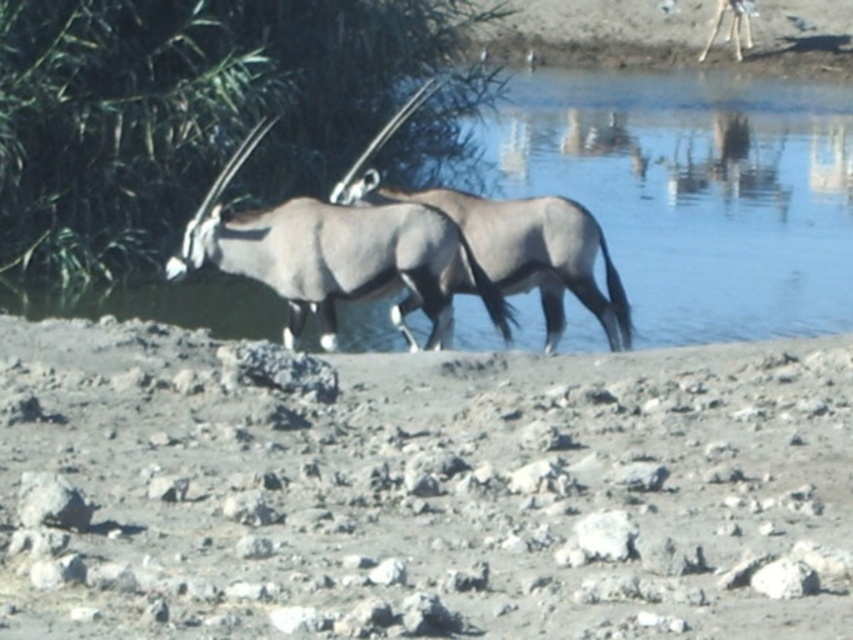
How far apart are clear blue water at center and gray matte antelope at center?

clear blue water at center and gray matte antelope at center are 10.44 meters apart from each other.

Is point (686, 317) positioned in front of point (614, 348)?

No, it is behind (614, 348).

Where is `clear blue water at center`? clear blue water at center is located at coordinates (691, 192).

Is clear blue water at center bigger than grayish-brown fur antelope at center?

Indeed, clear blue water at center has a larger size compared to grayish-brown fur antelope at center.

How much distance is there between clear blue water at center and grayish-brown fur antelope at center?

They are 7.03 meters apart.

What do you see at coordinates (691, 192) in the screenshot?
I see `clear blue water at center` at bounding box center [691, 192].

The height and width of the screenshot is (640, 853). I want to click on clear blue water at center, so click(691, 192).

Who is higher up, grayish-brown fur antelope at center or gray matte antelope at center?

gray matte antelope at center is higher up.

Which is in front, point (369, 291) or point (480, 208)?

Point (369, 291) is more forward.

The height and width of the screenshot is (640, 853). Identify the location of grayish-brown fur antelope at center. (334, 253).